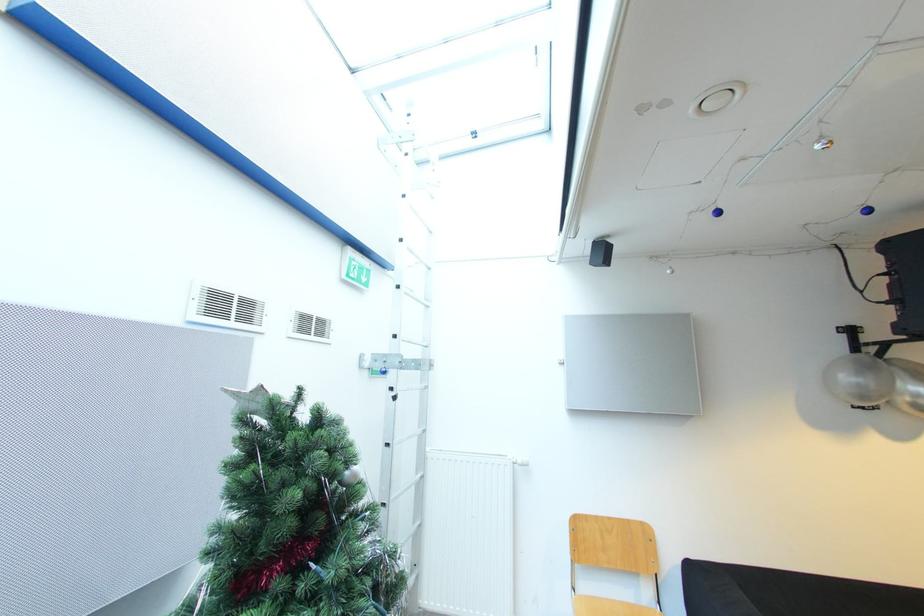
Image resolution: width=924 pixels, height=616 pixels. Describe the element at coordinates (609, 607) in the screenshot. I see `the wooden chair sitting surface` at that location.